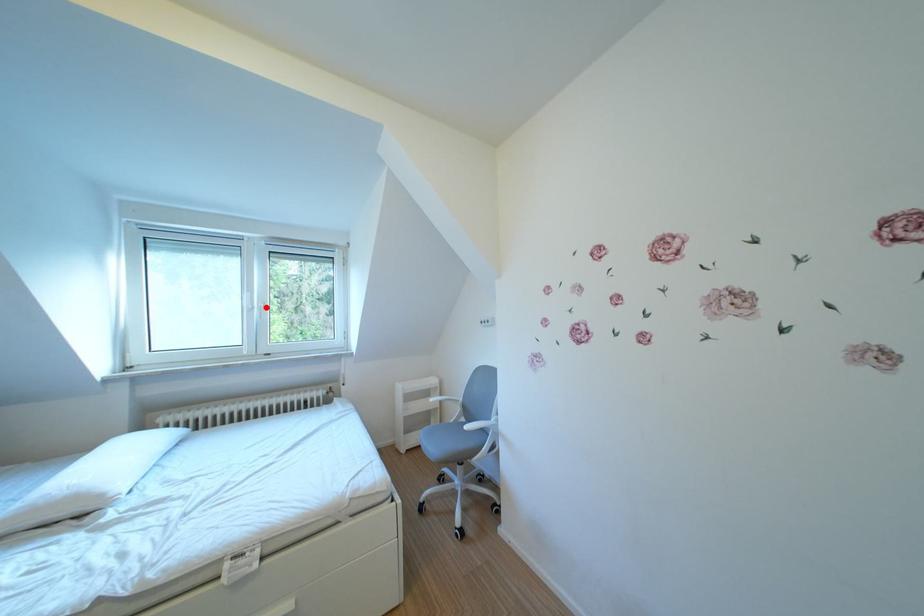
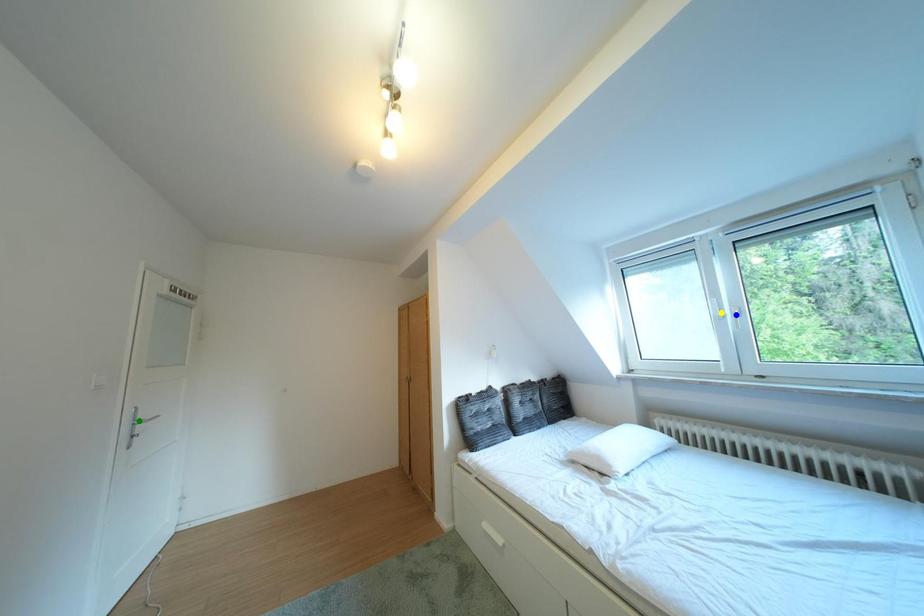
Question: I am providing you with two images of the same scene from different viewpoints. A red point is marked on the first image. You are given multiple points on the second image. Which mark in image 2 goes with the point in image 1?

Choices:
 (A) blue point
 (B) yellow point
 (C) green point

Answer: (A)